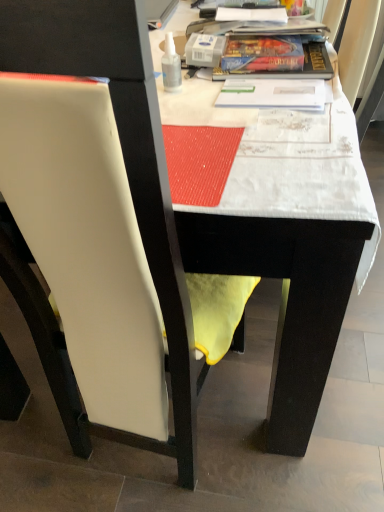
The width and height of the screenshot is (384, 512). I want to click on vacant area that lies in front of transparent plastic bottle at upper center, so click(x=196, y=110).